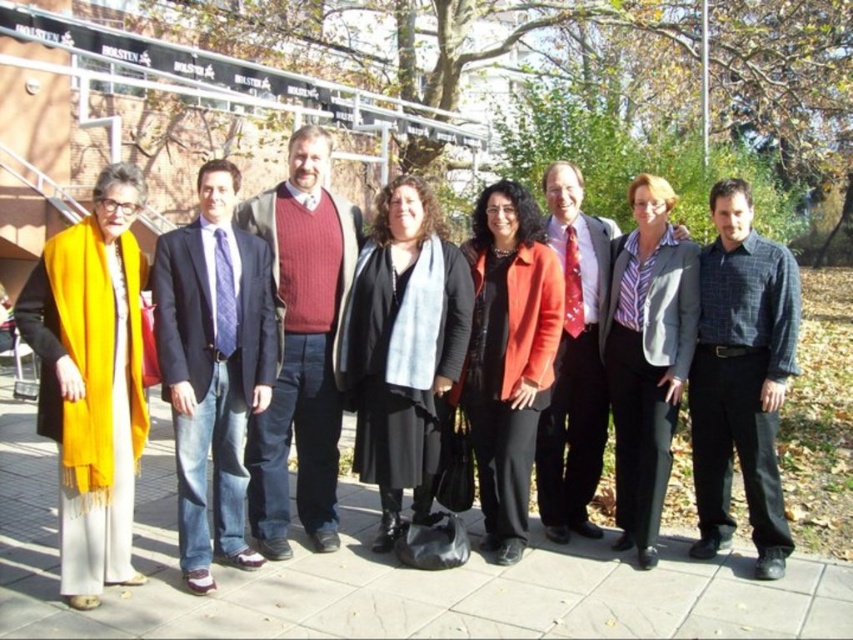
You are organizing a photo shoot and need to arrange two key items in the scene. The black matte coat at center and the matte red jacket at center are both important props. According to the image, how should you describe their spatial relationship to ensure they are placed correctly?

The black matte coat at center should be placed on the left side of the matte red jacket at center to match their positions in the image.

From the picture: You are a photographer taking a group photo and need to ensure that the checkered shirt at center and the matte red jacket at center are both visible. Based on their positions, which one is closer to the camera?

The checkered shirt at center is positioned under the matte red jacket at center, so the checkered shirt at center is closer to the camera.